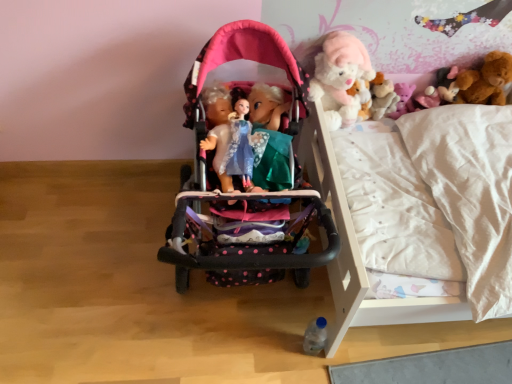
Locate an element on the screen. unoccupied space behind clear plastic bottle at lower center, the fourth toy when ordered from top to bottom is located at coordinates (297, 311).